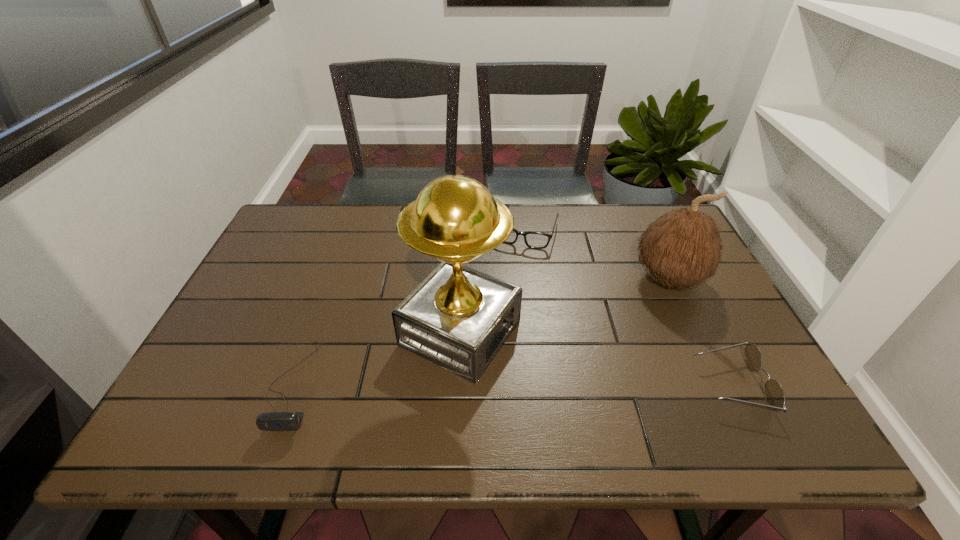
Where is `webcam`? This screenshot has height=540, width=960. webcam is located at coordinates click(272, 421).

At what (x,y) coordinates should I click in order to perform the action: click on the right spectacles. Please return your answer as a coordinate pair (x, y). This screenshot has height=540, width=960. Looking at the image, I should click on (774, 394).

The image size is (960, 540). I want to click on the fourth shortest object, so click(x=683, y=248).

The image size is (960, 540). What are the coordinates of `award` in the screenshot? It's located at (458, 318).

Image resolution: width=960 pixels, height=540 pixels. I want to click on the farthest object, so click(x=536, y=240).

I want to click on the left spectacles, so click(x=536, y=240).

In order to click on free space located 0.300m on the front-facing side of the nearer spectacles in this screenshot , I will do click(565, 384).

At what (x,y) coordinates should I click in order to perform the action: click on vacant space located on the front-facing side of the nearer spectacles. Please return your answer as a coordinate pair (x, y). Looking at the image, I should click on (643, 384).

Locate an element on the screen. vacant space positioned on the front-facing side of the nearer spectacles is located at coordinates (620, 384).

This screenshot has height=540, width=960. I want to click on vacant space positioned on the surface of the coconut, so click(x=634, y=308).